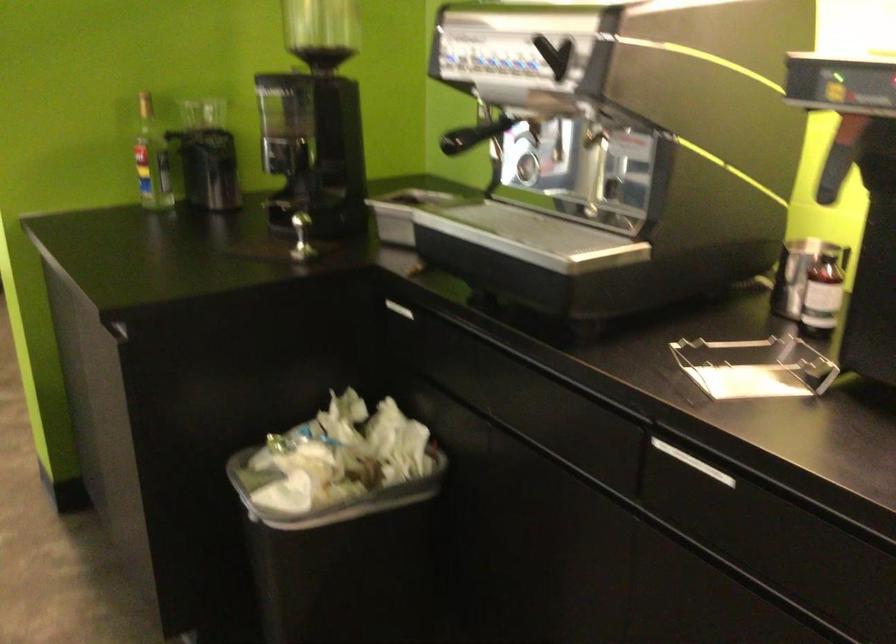
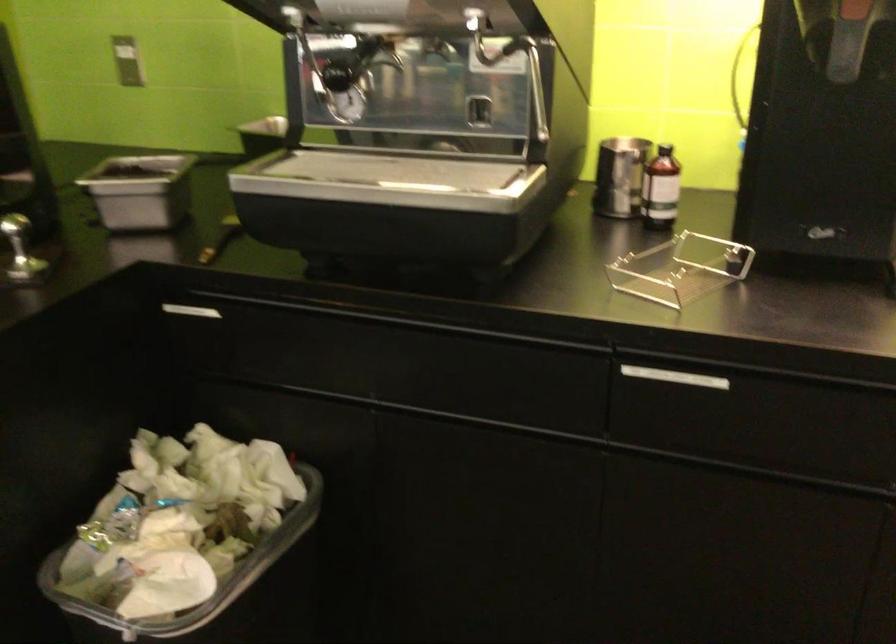
Locate, in the second image, the point that corresponds to pixel 313 509 in the first image.

(218, 592)